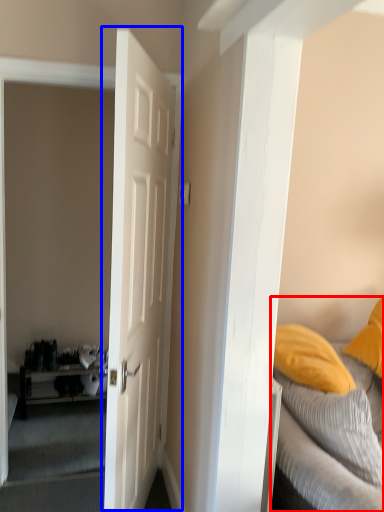
Question: Which object is closer to the camera taking this photo, bed (highlighted by a red box) or door (highlighted by a blue box)?

Choices:
 (A) bed
 (B) door

Answer: (B)